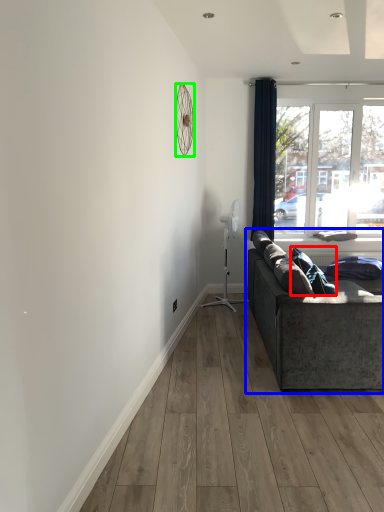
Question: Which object is positioned farthest from pillow (highlighted by a red box)? Select from studio couch (highlighted by a blue box) and mechanical fan (highlighted by a green box).

Choices:
 (A) studio couch
 (B) mechanical fan

Answer: (B)